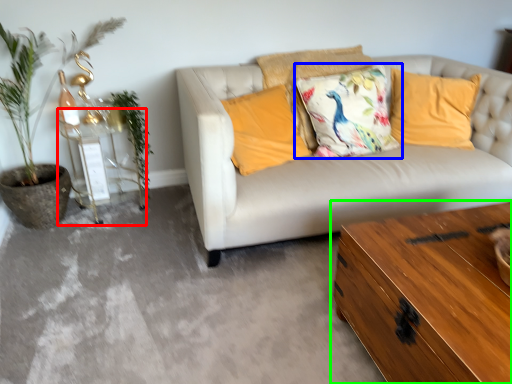
Question: Which is nearer to the side table (highlighted by a red box)? pillow (highlighted by a blue box) or table (highlighted by a green box).

Choices:
 (A) pillow
 (B) table

Answer: (A)